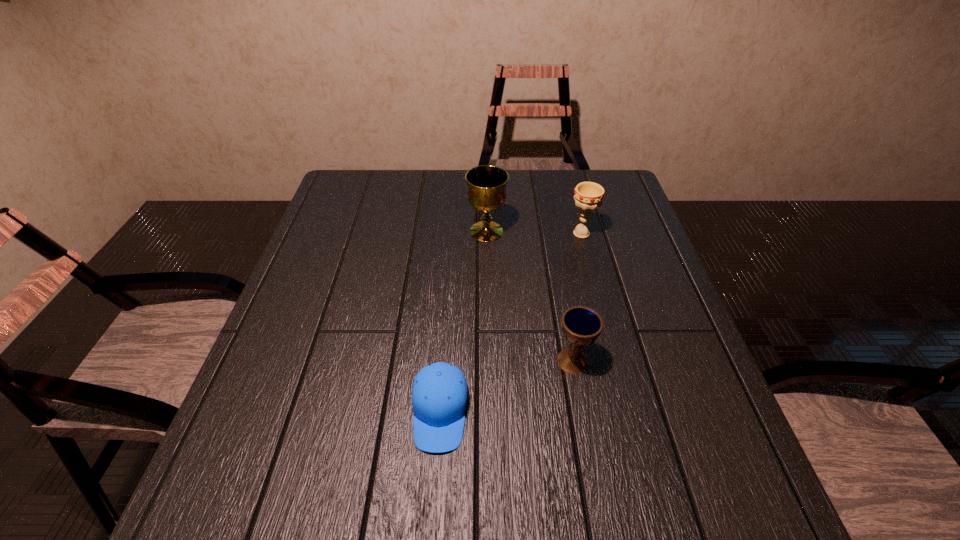
The width and height of the screenshot is (960, 540). I want to click on vacant space that satisfies the following two spatial constraints: 1. on the back side of the rightmost object; 2. on the left side of the third object from left to right, so click(x=550, y=233).